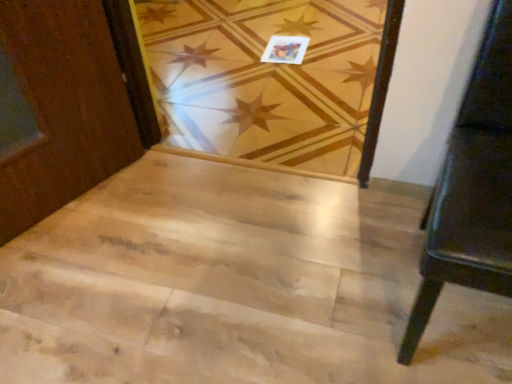
Find the location of a particular element. The height and width of the screenshot is (384, 512). unoccupied space behind matte paper postcard at upper center is located at coordinates (279, 27).